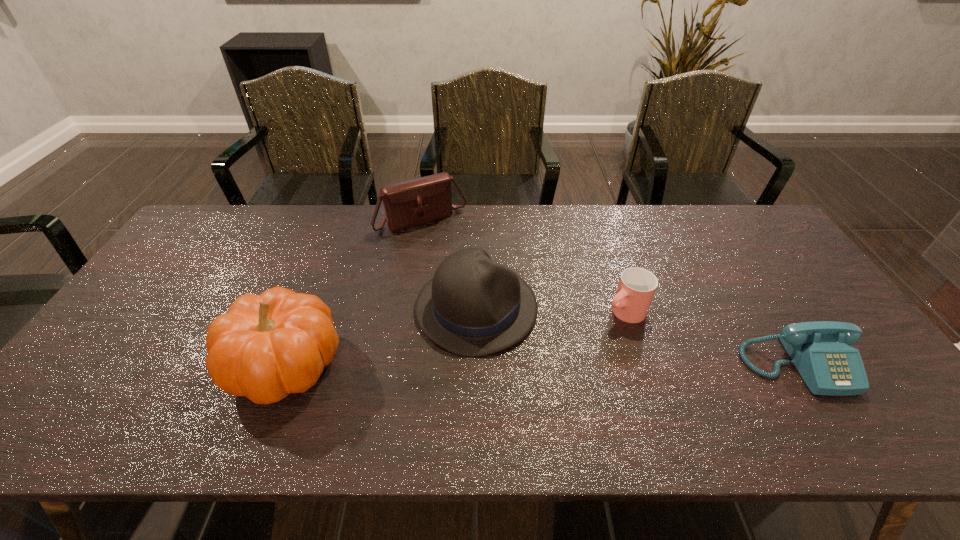
This screenshot has width=960, height=540. What are the coordinates of `unoccupied position between the rightmost object and the pumpkin` in the screenshot? It's located at (541, 364).

Image resolution: width=960 pixels, height=540 pixels. Find the location of `vacant area between the tallest object and the bowler hat`. vacant area between the tallest object and the bowler hat is located at coordinates (381, 336).

Find the location of a particular element. Image resolution: width=960 pixels, height=540 pixels. vacant area between the tallest object and the farthest object is located at coordinates (353, 292).

You are a GUI agent. You are given a task and a screenshot of the screen. Output one action in this format:
    pyautogui.click(x=<x>, y=<y>)
    Task: Click on the unoccupied area between the rightmost object and the pumpkin
    This screenshot has height=540, width=960.
    Given the screenshot: What is the action you would take?
    pyautogui.click(x=541, y=364)

Find the location of `object identified as the second closest to the tallest object`. object identified as the second closest to the tallest object is located at coordinates (417, 201).

Select which object is the closest to the second object from right to left. Please provide its 2D coordinates. Your answer should be formatted as a tuple, i.e. [(x, y)], where the tuple contains the x and y coordinates of a point satisfying the conditions above.

[(473, 306)]

You are a GUI agent. You are given a task and a screenshot of the screen. Output one action in this format:
    pyautogui.click(x=<x>, y=<y>)
    Task: Click on the vacant space that satisfies the following two spatial constraints: 1. on the back side of the farthest object; 2. on the left side of the pumpkin
    The image size is (960, 540).
    Given the screenshot: What is the action you would take?
    pyautogui.click(x=341, y=220)

I want to click on free space in the image that satisfies the following two spatial constraints: 1. on the front side of the farthest object; 2. on the left side of the second object from right to left, so click(x=407, y=312).

Locate an element on the screen. This screenshot has height=540, width=960. free space that satisfies the following two spatial constraints: 1. on the front side of the shoulder bag; 2. on the right side of the fourth object from left to right is located at coordinates (407, 312).